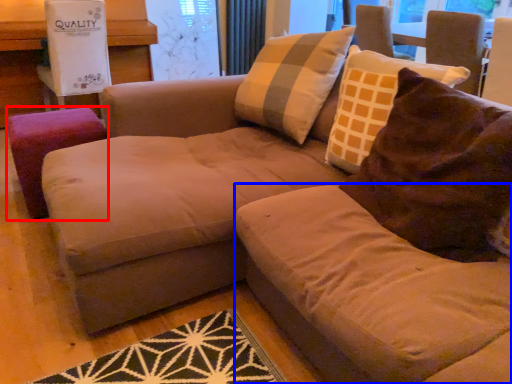
Question: Which object appears farthest to the camera in this image, stool (highlighted by a red box) or beige (highlighted by a blue box)?

Choices:
 (A) stool
 (B) beige

Answer: (A)